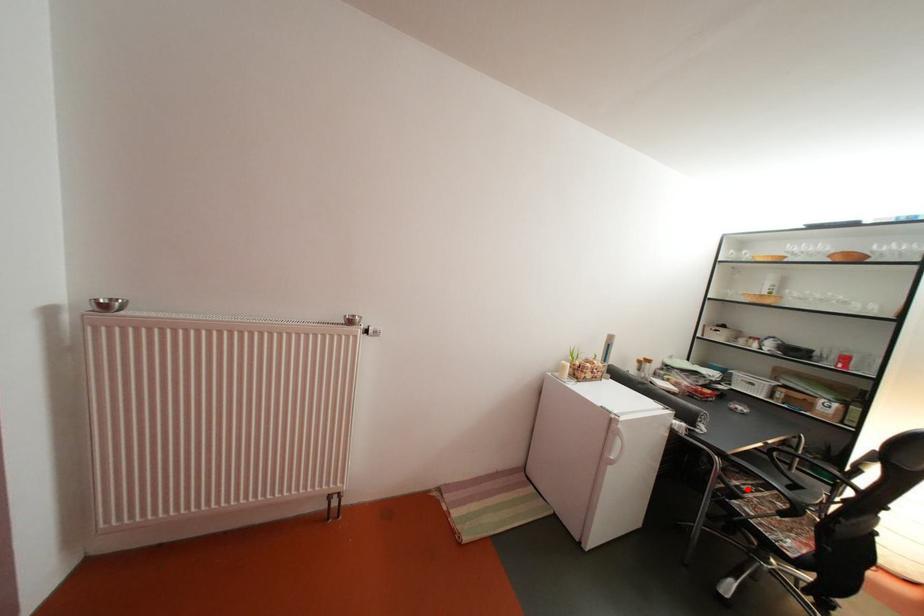
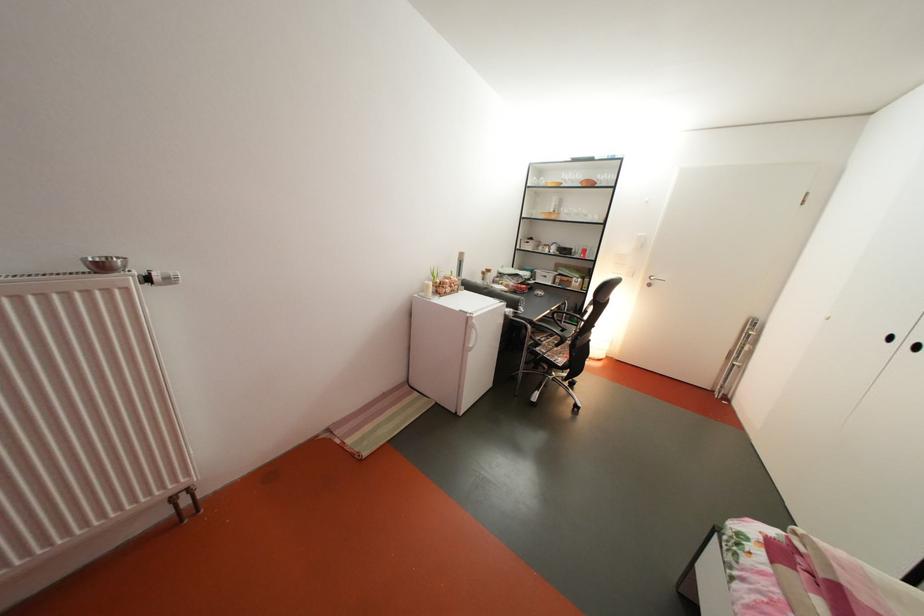
Find the pixel in the second image that matches the highlighted location in the first image.

(550, 344)